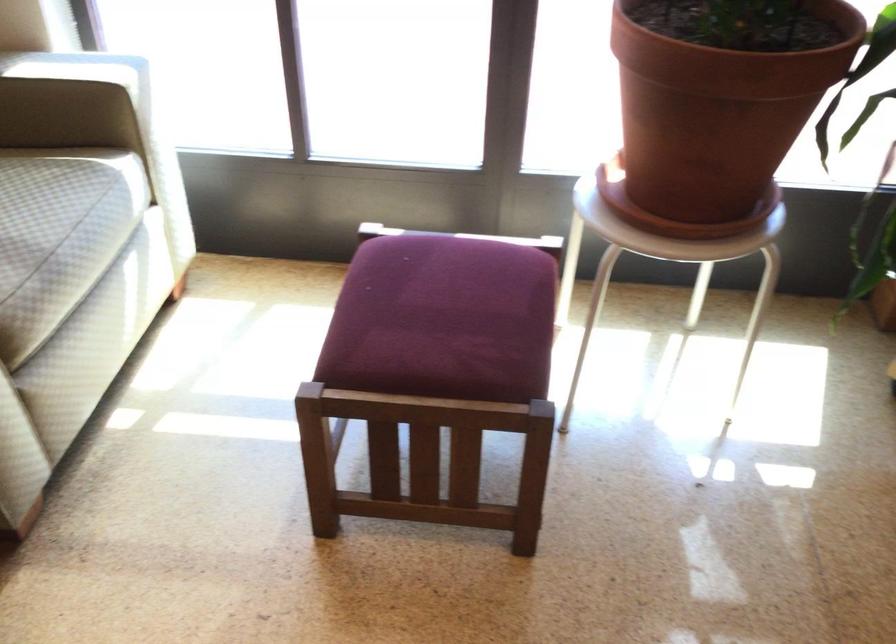
This screenshot has width=896, height=644. Find the location of `sofa sitting surface`. sofa sitting surface is located at coordinates (35, 214).